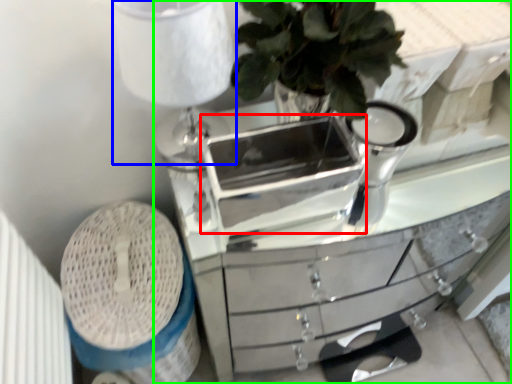
Question: Which is farther away from appliance (highlighted by a red box)? table lamp (highlighted by a blue box) or chest of drawers (highlighted by a green box)?

Choices:
 (A) table lamp
 (B) chest of drawers

Answer: (A)